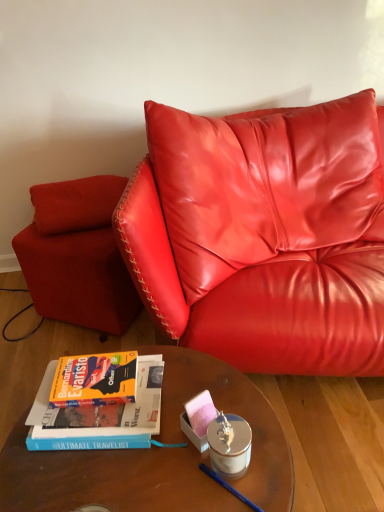
Image resolution: width=384 pixels, height=512 pixels. I want to click on wooden glass table at center, so click(x=157, y=456).

Measure the distance between velvet red pillow at upper left and camera.

velvet red pillow at upper left and camera are 5.26 feet apart.

Measure the distance between silver metallic candle holder at center and camera.

silver metallic candle holder at center and camera are 85.95 centimeters apart.

Locate an element on the screen. This screenshot has width=384, height=512. matte red armchair at lower left is located at coordinates (77, 255).

Is hardcover book at lower left with silver metallic candle holder at center?

No.

Does hardcover book at lower left have a greater width compared to silver metallic candle holder at center?

Correct, the width of hardcover book at lower left exceeds that of silver metallic candle holder at center.

Looking at this image, from the image's perspective, relative to silver metallic candle holder at center, is hardcover book at lower left above or below?

Clearly, from the image's perspective, hardcover book at lower left is above silver metallic candle holder at center.

Based on their sizes in the image, would you say velvet red pillow at upper left is bigger or smaller than matte red armchair at lower left?

velvet red pillow at upper left is smaller than matte red armchair at lower left.

Is velvet red pillow at upper left outside of matte red armchair at lower left?

velvet red pillow at upper left lies outside matte red armchair at lower left's area.

From a real-world perspective, which is physically below, velvet red pillow at upper left or matte red armchair at lower left?

matte red armchair at lower left is physically lower.

Is silver metallic candle holder at center turned away from hardcover book at lower left?

Correct, silver metallic candle holder at center is looking away from hardcover book at lower left.

Can you see silver metallic candle holder at center touching hardcover book at lower left?

silver metallic candle holder at center and hardcover book at lower left are clearly separated.

Is silver metallic candle holder at center positioned beyond the bounds of hardcover book at lower left?

Yes, silver metallic candle holder at center is located beyond the bounds of hardcover book at lower left.

Find the location of a particular element. The image size is (384, 512). book behind the silver metallic candle holder at center is located at coordinates (99, 416).

From the image's perspective, does silver metallic candle holder at center appear higher than matte red armchair at lower left?

No, from the image's perspective, silver metallic candle holder at center is not over matte red armchair at lower left.

Could you tell me if silver metallic candle holder at center is facing matte red armchair at lower left?

No, silver metallic candle holder at center is not oriented towards matte red armchair at lower left.

Image resolution: width=384 pixels, height=512 pixels. What are the coordinates of `candle holder that is in front of the matte red armchair at lower left` in the screenshot? It's located at (230, 446).

Would you say silver metallic candle holder at center contains matte red armchair at lower left?

No, silver metallic candle holder at center does not contain matte red armchair at lower left.

Find the location of `candle holder that is on the right side of matte red armchair at lower left`. candle holder that is on the right side of matte red armchair at lower left is located at coordinates 230,446.

Is matte red armchair at lower left far from silver metallic candle holder at center?

No, matte red armchair at lower left is not far away from silver metallic candle holder at center.

Who is taller, matte red armchair at lower left or silver metallic candle holder at center?

matte red armchair at lower left is taller.

How different are the orientations of matte red armchair at lower left and silver metallic candle holder at center in degrees?

The angular difference between matte red armchair at lower left and silver metallic candle holder at center is 58.5 degrees.

Is wooden glass table at center shorter than velvet red pillow at upper left?

Incorrect, the height of wooden glass table at center does not fall short of that of velvet red pillow at upper left.

Is wooden glass table at center oriented away from velvet red pillow at upper left?

Yes.

Find the location of a particular element. This screenshot has height=512, width=384. pillow behind the wooden glass table at center is located at coordinates (76, 203).

Consider the image. Visually, is wooden glass table at center positioned to the left or to the right of velvet red pillow at upper left?

Clearly, wooden glass table at center is on the right of velvet red pillow at upper left in the image.

Is wooden glass table at center aimed at silver metallic candle holder at center?

No, wooden glass table at center does not turn towards silver metallic candle holder at center.

Does wooden glass table at center lie behind silver metallic candle holder at center?

No, it is in front of silver metallic candle holder at center.

The width and height of the screenshot is (384, 512). What are the coordinates of `candle holder above the wooden glass table at center (from a real-world perspective)` in the screenshot? It's located at (230, 446).

At what (x,y) coordinates should I click in order to perform the action: click on candle holder on the right of hardcover book at lower left. Please return your answer as a coordinate pair (x, y). Looking at the image, I should click on (230, 446).

At what (x,y) coordinates should I click in order to perform the action: click on armchair located below the velvet red pillow at upper left (from the image's perspective). Please return your answer as a coordinate pair (x, y). Looking at the image, I should click on (77, 255).

From the image, which object appears to be nearer to matte red armchair at lower left, silver metallic candle holder at center or velvet red pillow at upper left?

The object closer to matte red armchair at lower left is velvet red pillow at upper left.

Based on their spatial positions, is hardcover book at lower left or silver metallic candle holder at center closer to velvet red pillow at upper left?

hardcover book at lower left lies closer to velvet red pillow at upper left than the other object.

Considering their positions, is hardcover book at lower left positioned closer to silver metallic candle holder at center than matte red armchair at lower left?

hardcover book at lower left is positioned closer to the anchor silver metallic candle holder at center.

Looking at the image, which one is located further to velvet red pillow at upper left, hardcover book at lower left or matte red armchair at lower left?

hardcover book at lower left is further to velvet red pillow at upper left.

From the picture: From the image, which object appears to be nearer to velvet red pillow at upper left, hardcover book at lower left or wooden glass table at center?

The object closer to velvet red pillow at upper left is hardcover book at lower left.

Estimate the real-world distances between objects in this image. Which object is further from wooden glass table at center, hardcover book at lower left or silver metallic candle holder at center?

The object further to wooden glass table at center is silver metallic candle holder at center.

Considering their positions, is velvet red pillow at upper left positioned further to hardcover book at lower left than matte red armchair at lower left?

Based on the image, velvet red pillow at upper left appears to be further to hardcover book at lower left.

Which object lies nearer to the anchor point velvet red pillow at upper left, silver metallic candle holder at center or hardcover book at lower left?

The object closer to velvet red pillow at upper left is hardcover book at lower left.

Locate an element on the screen. The width and height of the screenshot is (384, 512). book between wooden glass table at center and matte red armchair at lower left from front to back is located at coordinates (99, 416).

Find the location of a particular element. This screenshot has width=384, height=512. candle holder that lies between velvet red pillow at upper left and wooden glass table at center from top to bottom is located at coordinates (230, 446).

The width and height of the screenshot is (384, 512). I want to click on armchair located between silver metallic candle holder at center and velvet red pillow at upper left in the depth direction, so click(77, 255).

This screenshot has width=384, height=512. In order to click on candle holder positioned between wooden glass table at center and matte red armchair at lower left from near to far in this screenshot , I will do `click(230, 446)`.